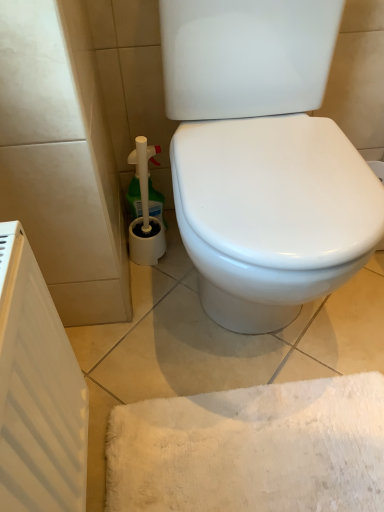
Question: Considering the positions of point (23, 474) and point (132, 210), is point (23, 474) closer or farther from the camera than point (132, 210)?

Choices:
 (A) farther
 (B) closer

Answer: (B)

Question: Considering the positions of white matte radiator at left and green plastic cleaner at lower left in the image, is white matte radiator at left bigger or smaller than green plastic cleaner at lower left?

Choices:
 (A) big
 (B) small

Answer: (A)

Question: Is white matte radiator at left in front of or behind green plastic cleaner at lower left in the image?

Choices:
 (A) behind
 (B) front

Answer: (B)

Question: From the image's perspective, relative to white matte radiator at left, is green plastic cleaner at lower left above or below?

Choices:
 (A) above
 (B) below

Answer: (A)

Question: Relative to white matte radiator at left, is green plastic cleaner at lower left in front or behind?

Choices:
 (A) behind
 (B) front

Answer: (A)

Question: Which is correct: green plastic cleaner at lower left is inside white matte radiator at left, or outside of it?

Choices:
 (A) inside
 (B) outside

Answer: (B)

Question: Based on their positions, is green plastic cleaner at lower left located to the left or right of white matte radiator at left?

Choices:
 (A) left
 (B) right

Answer: (B)